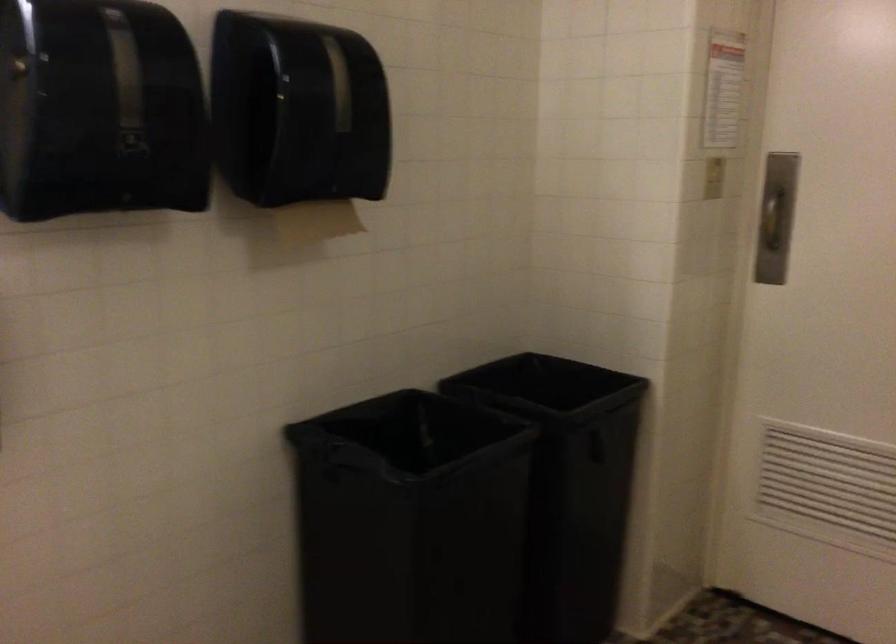
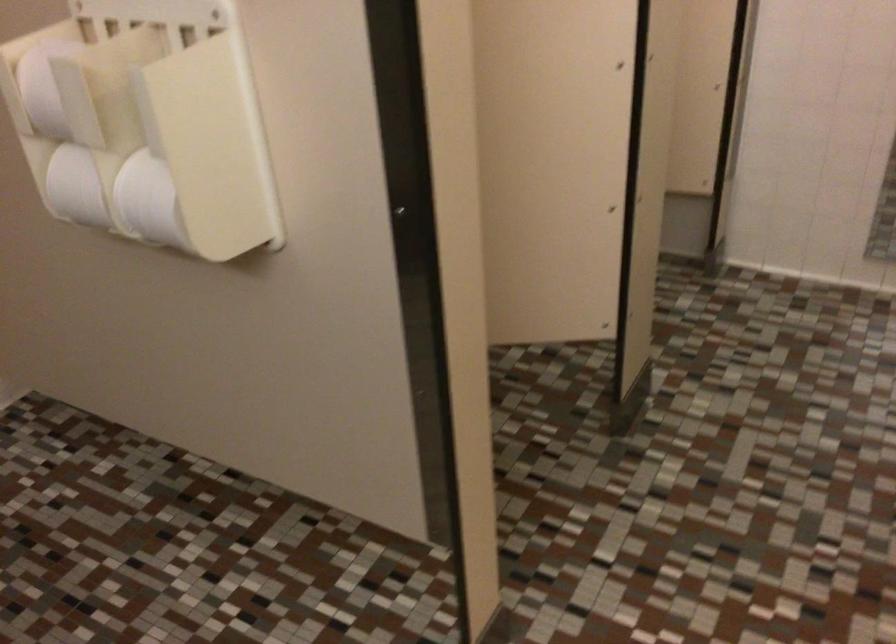
The first image is from the beginning of the video and the second image is from the end. How did the camera likely rotate when shooting the video?

The camera rotated toward right-down.